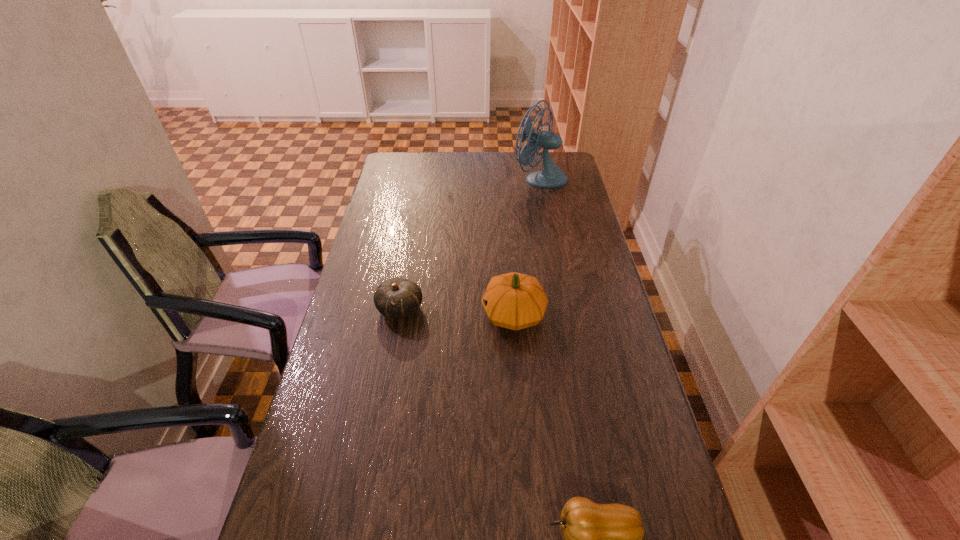
This screenshot has height=540, width=960. I want to click on vacant area located on the right of the leftmost object, so click(440, 308).

This screenshot has width=960, height=540. In order to click on object situated at the far edge in this screenshot , I will do point(551,176).

I want to click on object that is at the left edge, so click(x=397, y=297).

In order to click on object present at the right edge in this screenshot , I will do `click(551, 176)`.

Find the location of a particular element. The width and height of the screenshot is (960, 540). object situated at the far right corner is located at coordinates (551, 176).

In the image, there is a desktop. What are the coordinates of `free region at the far edge` in the screenshot? It's located at (448, 171).

Find the location of a particular element. free space at the left edge of the desktop is located at coordinates (x=361, y=441).

You are a GUI agent. You are given a task and a screenshot of the screen. Output one action in this format:
    pyautogui.click(x=<x>, y=<y>)
    Task: Click on the free point at the right edge
    This screenshot has height=540, width=960.
    Given the screenshot: What is the action you would take?
    pyautogui.click(x=591, y=380)

The image size is (960, 540). Find the location of `free space between the farthest object and the tallest gourd`. free space between the farthest object and the tallest gourd is located at coordinates (527, 246).

Identify the location of free spot between the farthest object and the leftmost object. (470, 244).